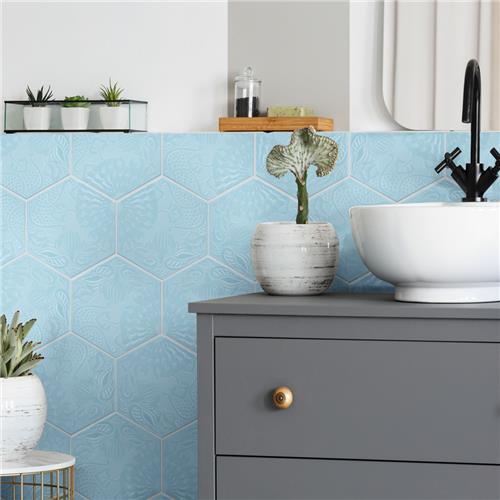
Locate an element on the screen. The height and width of the screenshot is (500, 500). mirror is located at coordinates (416, 71).